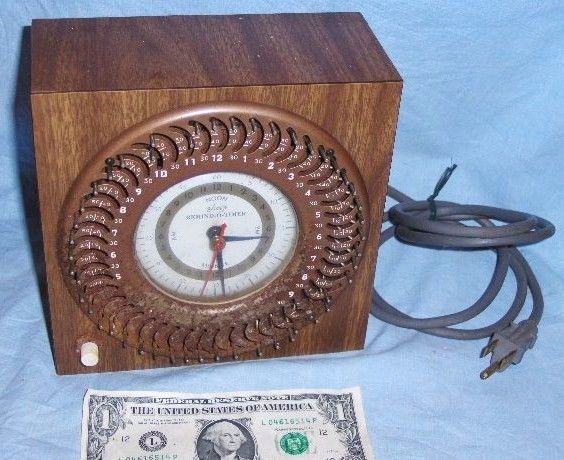
The image size is (564, 460). I want to click on electrical plug, so click(518, 338).